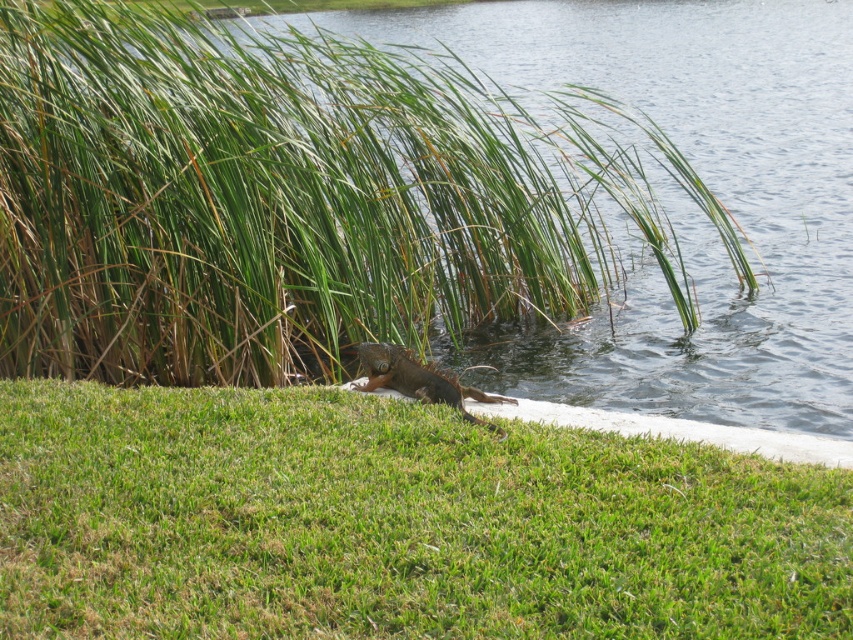
You are standing on the green grassy at lower center and want to reach the clear water at grass right. Which direction should you move to get there?

You should move towards the right direction because the clear water at grass right is positioned over the green grassy at lower center.

In the scene shown: You are standing at the point labeled as point (x=650, y=54) in the image. If you want to walk towards the water, which direction should you go?

Since the point (x=650, y=54) is 22.54 meters away from the viewer, you should walk towards the direction facing the water to reach it.